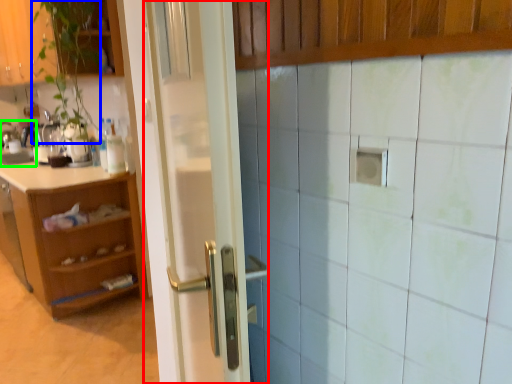
Question: Based on their relative distances, which object is farther from door (highlighted by a red box)? Choose from plant (highlighted by a blue box) and sink (highlighted by a green box).

Choices:
 (A) plant
 (B) sink

Answer: (B)